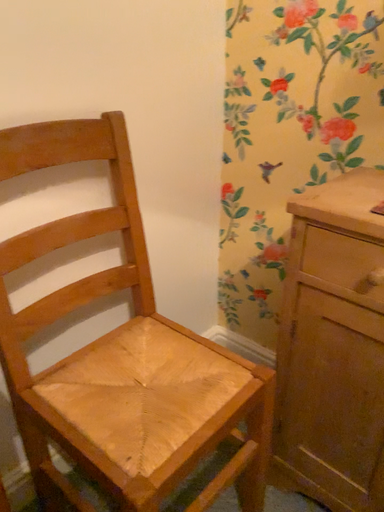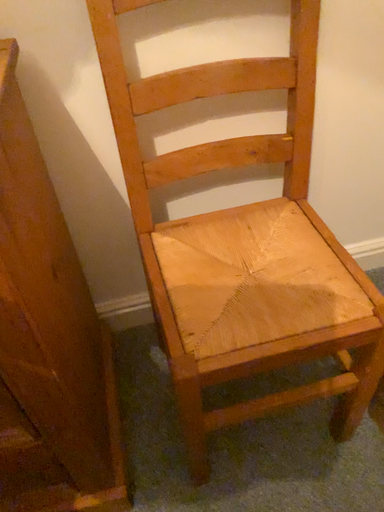
Question: How did the camera likely rotate when shooting the video?

Choices:
 (A) rotated right
 (B) rotated left

Answer: (B)